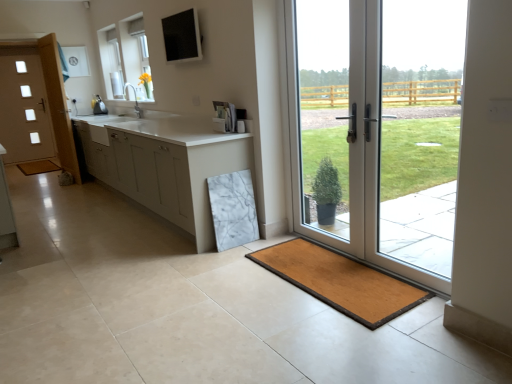
Question: Is white matte cabinet at center to the left of white glass door at left, which is the second door in front-to-back order, from the viewer's perspective?

Choices:
 (A) no
 (B) yes

Answer: (A)

Question: Is white matte cabinet at center with white glass door at left, which is the second door from right to left?

Choices:
 (A) yes
 (B) no

Answer: (B)

Question: Is white matte cabinet at center far away from white glass door at left, which is the second door from right to left?

Choices:
 (A) yes
 (B) no

Answer: (A)

Question: Is white matte cabinet at center at the right side of white glass door at left, which is the second door in front-to-back order?

Choices:
 (A) no
 (B) yes

Answer: (B)

Question: From a real-world perspective, is white matte cabinet at center physically below white glass door at left, the 1th door in the left-to-right sequence?

Choices:
 (A) yes
 (B) no

Answer: (A)

Question: Is white matte cabinet at center further to the viewer compared to white glass door at left, which is the second door from right to left?

Choices:
 (A) yes
 (B) no

Answer: (B)

Question: From a real-world perspective, is brown wooden bath mat at lower left, the 1th bath mat when ordered from back to front, beneath white matte cabinet at center?

Choices:
 (A) yes
 (B) no

Answer: (A)

Question: From a real-world perspective, does brown wooden bath mat at lower left, marked as the 1th bath mat in a left-to-right arrangement, stand above white matte cabinet at center?

Choices:
 (A) no
 (B) yes

Answer: (A)

Question: Is white matte cabinet at center completely or partially inside brown wooden bath mat at lower left, which appears as the 2th bath mat when viewed from the right?

Choices:
 (A) yes
 (B) no

Answer: (B)

Question: Does brown wooden bath mat at lower left, the 2th bath mat positioned from the bottom, lie behind white matte cabinet at center?

Choices:
 (A) no
 (B) yes

Answer: (B)

Question: Is brown wooden bath mat at lower left, marked as the 1th bath mat in a left-to-right arrangement, next to white matte cabinet at center and touching it?

Choices:
 (A) no
 (B) yes

Answer: (A)

Question: Does brown wooden bath mat at lower left, marked as the 1th bath mat in a top-to-bottom arrangement, come in front of white matte cabinet at center?

Choices:
 (A) no
 (B) yes

Answer: (A)

Question: Is brown wooden bath mat at lower left, the 2th bath mat positioned from the bottom, located within white matte cabinet at center?

Choices:
 (A) yes
 (B) no

Answer: (B)